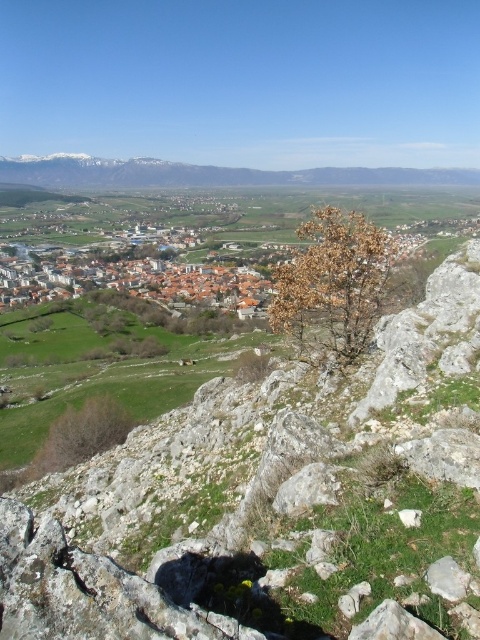
You are standing at a high vantage point overlooking the landscape. There are two points marked on the image, point 1 at coordinates (311, 172) and point 2 at (103, 442). Which point is closer to your current position?

Point 1 at coordinates (311, 172) is closer to your current position because it is further to the viewer than point 2 at (103, 442).

You are standing at the bottom of the green grassy hill at center and want to walk to the gray rough stone at lower right. Which direction should you head?

You should head to the right because the gray rough stone at lower right is located to the right of the green grassy hill at center.